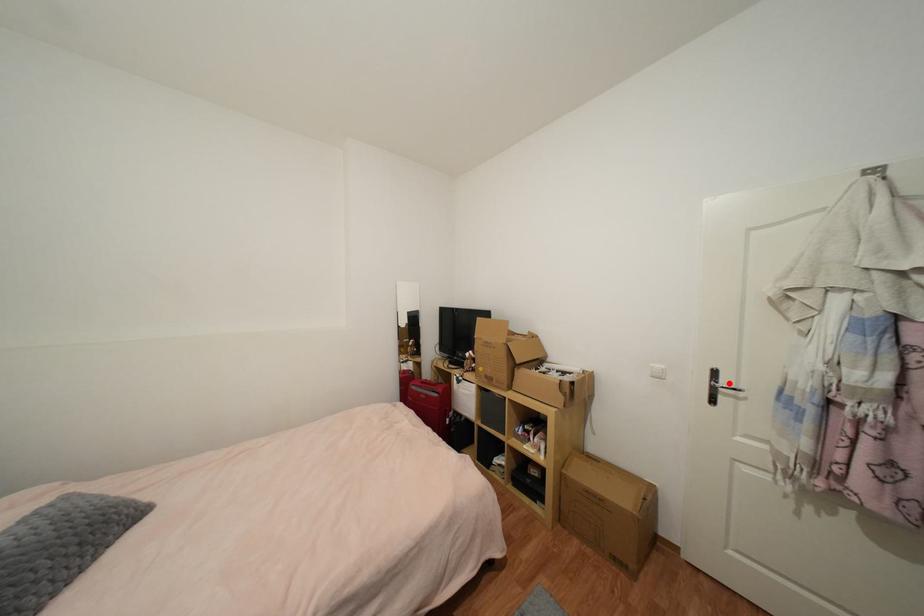
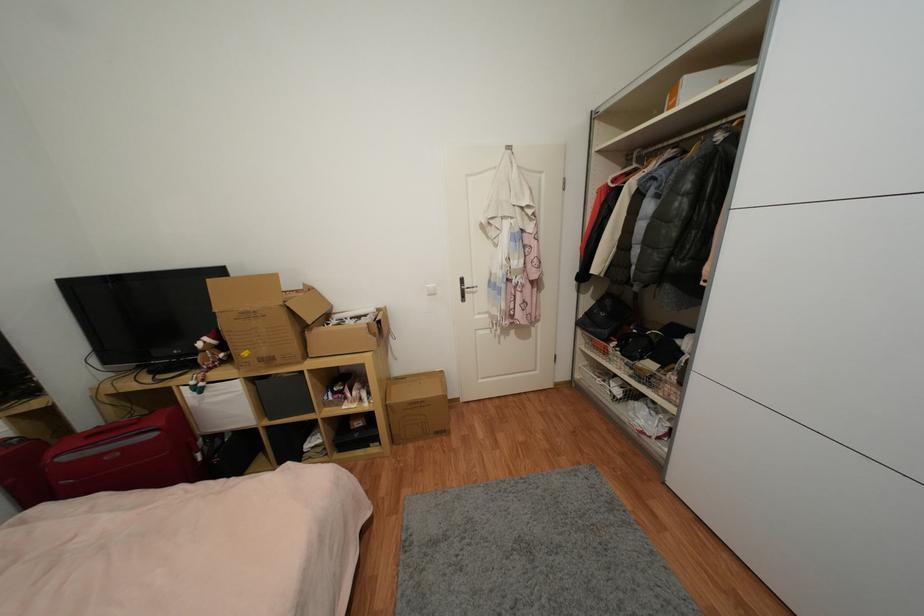
Where in the second image is the point corresponding to the highlighted location from the first image?

(471, 286)